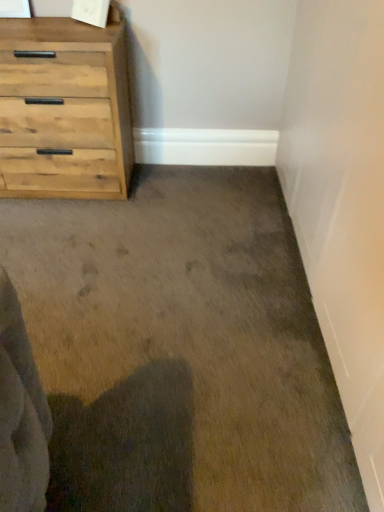
The width and height of the screenshot is (384, 512). What do you see at coordinates (64, 109) in the screenshot?
I see `natural wood chest of drawers at upper left` at bounding box center [64, 109].

You are a GUI agent. You are given a task and a screenshot of the screen. Output one action in this format:
    pyautogui.click(x=<x>, y=<y>)
    Task: Click on the natural wood chest of drawers at upper left
    The height and width of the screenshot is (512, 384).
    Given the screenshot: What is the action you would take?
    pyautogui.click(x=64, y=109)

Where is `natural wood chest of drawers at upper left`? natural wood chest of drawers at upper left is located at coordinates (64, 109).